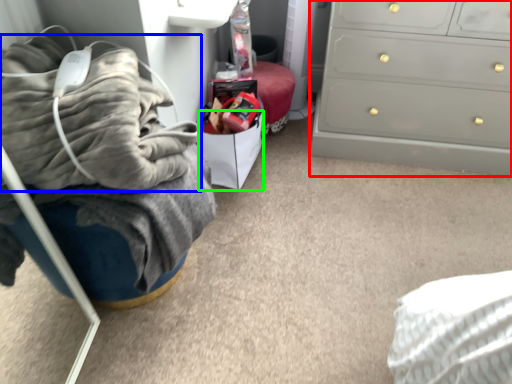
Question: Which is farther away from chest of drawers (highlighted by a red box)? blanket (highlighted by a blue box) or drawer (highlighted by a green box)?

Choices:
 (A) blanket
 (B) drawer

Answer: (A)